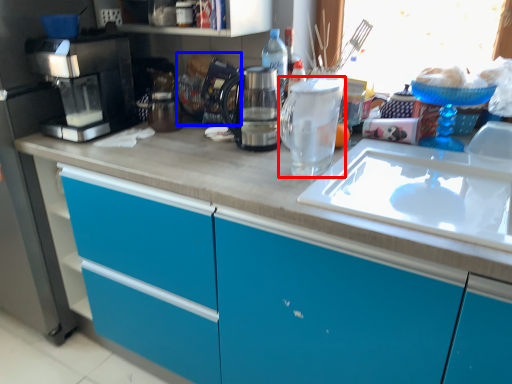
Question: Which object appears closest to the camera in this image, kitchen appliance (highlighted by a red box) or appliance (highlighted by a blue box)?

Choices:
 (A) kitchen appliance
 (B) appliance

Answer: (A)